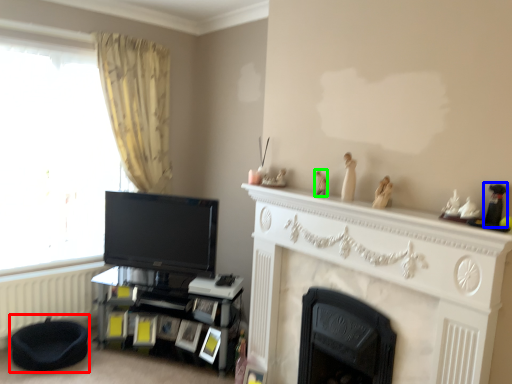
Question: Based on their relative distances, which object is farther from bean bag chair (highlighted by a red box)? Choose from toy (highlighted by a blue box) and toy (highlighted by a green box).

Choices:
 (A) toy
 (B) toy

Answer: (A)